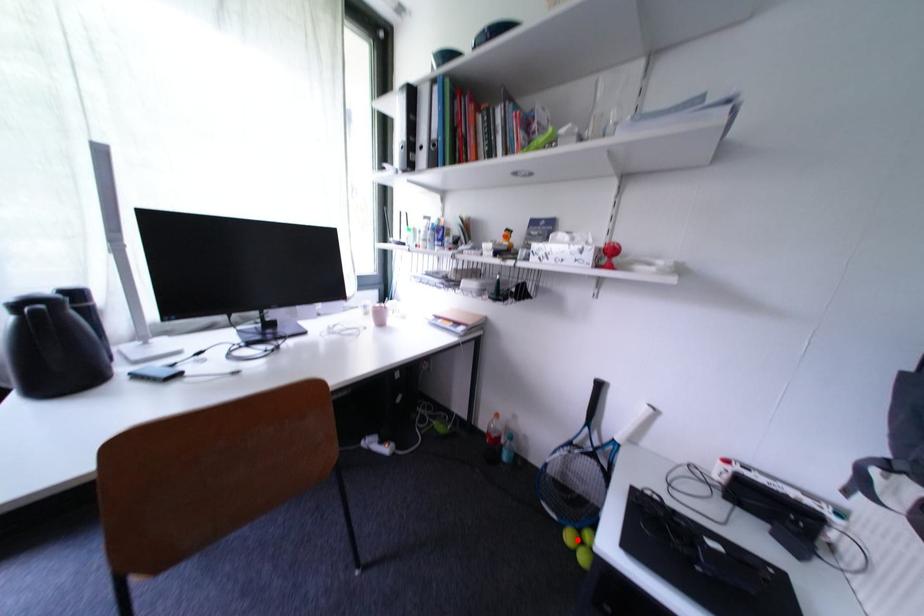
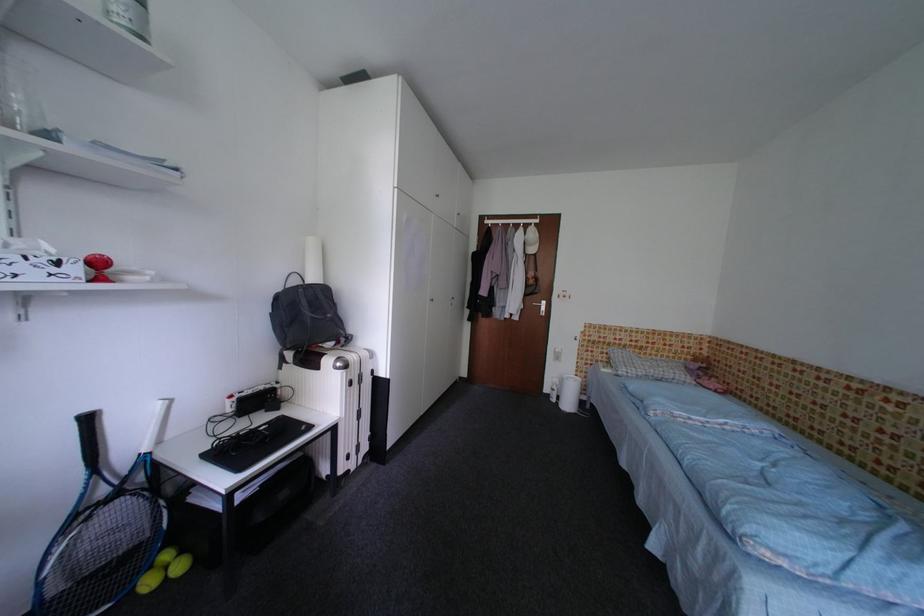
Question: A red point is marked in image1. In image2, is the corresponding 3D point closer to the camera or farther? Reply with the corresponding letter.

Choices:
 (A) The corresponding 3D point is closer.
 (B) The corresponding 3D point is farther.

Answer: (A)